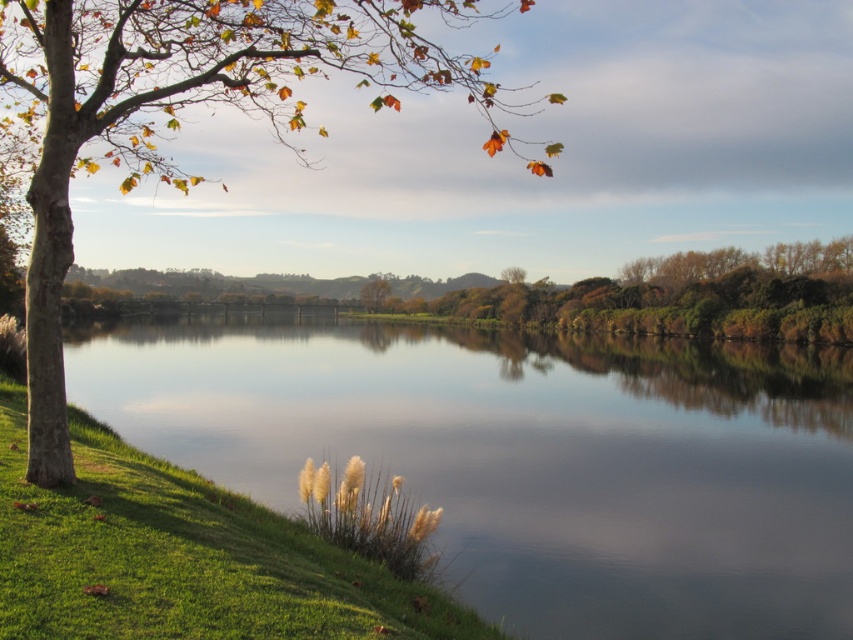
Question: Which point is closer to the camera?

Choices:
 (A) click(x=375, y=100)
 (B) click(x=367, y=292)

Answer: (A)

Question: In this image, where is green leafy trees at center located relative to green leafy tree at center?

Choices:
 (A) below
 (B) above

Answer: (A)

Question: Among these points, which one is farthest from the camera?

Choices:
 (A) (572, 355)
 (B) (372, 276)

Answer: (B)

Question: Among these points, which one is farthest from the camera?

Choices:
 (A) (369, 291)
 (B) (131, 24)
 (C) (717, 540)

Answer: (A)

Question: Does green grassy bank at lower left have a greater width compared to green leafy trees at center?

Choices:
 (A) yes
 (B) no

Answer: (A)

Question: Does brown rough bark tree at upper left appear on the left side of green leafy tree at center?

Choices:
 (A) yes
 (B) no

Answer: (B)